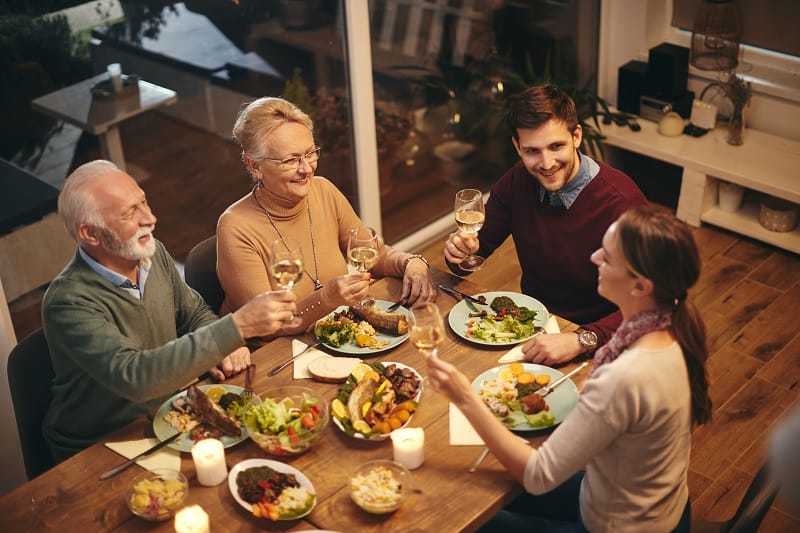
Locate an element on the screen. plate is located at coordinates (166, 429), (550, 402), (528, 298), (388, 333), (388, 365), (281, 467).